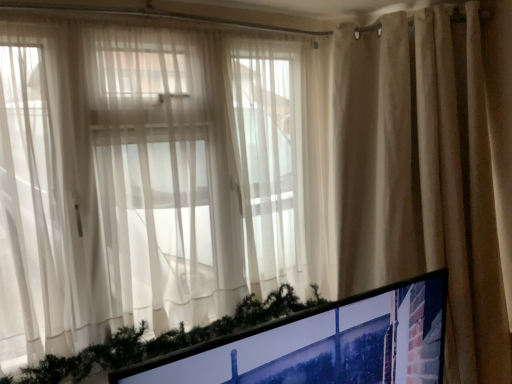
Image resolution: width=512 pixels, height=384 pixels. What do you see at coordinates (424, 179) in the screenshot?
I see `beige fabric curtain at upper right` at bounding box center [424, 179].

Locate an element on the screen. beige fabric curtain at upper right is located at coordinates (424, 179).

Where is `matte black monitor at lower right`? The image size is (512, 384). matte black monitor at lower right is located at coordinates (323, 344).

This screenshot has height=384, width=512. Describe the element at coordinates (323, 344) in the screenshot. I see `matte black monitor at lower right` at that location.

Identify the location of beige fabric curtain at upper right. The image size is (512, 384). (424, 179).

Considering the positions of objects matte black monitor at lower right and beige fabric curtain at upper right in the image provided, who is more to the left, matte black monitor at lower right or beige fabric curtain at upper right?

matte black monitor at lower right is more to the left.

Considering their positions, is matte black monitor at lower right located in front of or behind beige fabric curtain at upper right?

Clearly, matte black monitor at lower right is in front of beige fabric curtain at upper right.

Considering the positions of point (421, 315) and point (472, 215), is point (421, 315) closer or farther from the camera than point (472, 215)?

Clearly, point (421, 315) is closer to the camera than point (472, 215).

From the image's perspective, would you say matte black monitor at lower right is positioned over beige fabric curtain at upper right?

No, from the image's perspective, matte black monitor at lower right is not on top of beige fabric curtain at upper right.

From a real-world perspective, which is physically above, matte black monitor at lower right or beige fabric curtain at upper right?

beige fabric curtain at upper right.

Does matte black monitor at lower right have a greater width compared to beige fabric curtain at upper right?

Incorrect, the width of matte black monitor at lower right does not surpass that of beige fabric curtain at upper right.

Between matte black monitor at lower right and beige fabric curtain at upper right, which one has less height?

matte black monitor at lower right.

Is matte black monitor at lower right smaller than beige fabric curtain at upper right?

Yes.

In the scene shown: Is matte black monitor at lower right located outside beige fabric curtain at upper right?

Indeed, matte black monitor at lower right is completely outside beige fabric curtain at upper right.

Based on the photo, is matte black monitor at lower right next to beige fabric curtain at upper right and touching it?

No, matte black monitor at lower right is not making contact with beige fabric curtain at upper right.

Could you tell me if matte black monitor at lower right is turned towards beige fabric curtain at upper right?

No.

What are the coordinates of `computer monitor that appears below the beige fabric curtain at upper right (from a real-world perspective)` in the screenshot? It's located at click(323, 344).

Considering the positions of objects beige fabric curtain at upper right and matte black monitor at lower right in the image provided, who is more to the left, beige fabric curtain at upper right or matte black monitor at lower right?

From the viewer's perspective, matte black monitor at lower right appears more on the left side.

Does beige fabric curtain at upper right come behind matte black monitor at lower right?

Yes.

Which is in front, point (406, 157) or point (390, 315)?

The point (390, 315) is in front.

From the image's perspective, which is above, beige fabric curtain at upper right or matte black monitor at lower right?

beige fabric curtain at upper right is shown above in the image.

From a real-world perspective, is beige fabric curtain at upper right beneath matte black monitor at lower right?

No, from a real-world perspective, beige fabric curtain at upper right is not beneath matte black monitor at lower right.

Which object is wider, beige fabric curtain at upper right or matte black monitor at lower right?

beige fabric curtain at upper right is wider.

Which of these two, beige fabric curtain at upper right or matte black monitor at lower right, stands taller?

With more height is beige fabric curtain at upper right.

Considering the relative sizes of beige fabric curtain at upper right and matte black monitor at lower right in the image provided, is beige fabric curtain at upper right smaller than matte black monitor at lower right?

Actually, beige fabric curtain at upper right might be larger than matte black monitor at lower right.

Would you say beige fabric curtain at upper right is inside or outside matte black monitor at lower right?

beige fabric curtain at upper right is located beyond the bounds of matte black monitor at lower right.

Are beige fabric curtain at upper right and matte black monitor at lower right located far from each other?

beige fabric curtain at upper right is actually quite close to matte black monitor at lower right.

Is beige fabric curtain at upper right looking in the opposite direction of matte black monitor at lower right?

That's not correct — beige fabric curtain at upper right is not looking away from matte black monitor at lower right.

Locate an element on the screen. curtain above the matte black monitor at lower right (from the image's perspective) is located at coordinates (x=424, y=179).

Where is `curtain that is on the right side of matte black monitor at lower right`? Image resolution: width=512 pixels, height=384 pixels. curtain that is on the right side of matte black monitor at lower right is located at coordinates (424, 179).

Locate an element on the screen. curtain positioned vertically above the matte black monitor at lower right (from a real-world perspective) is located at coordinates (424, 179).